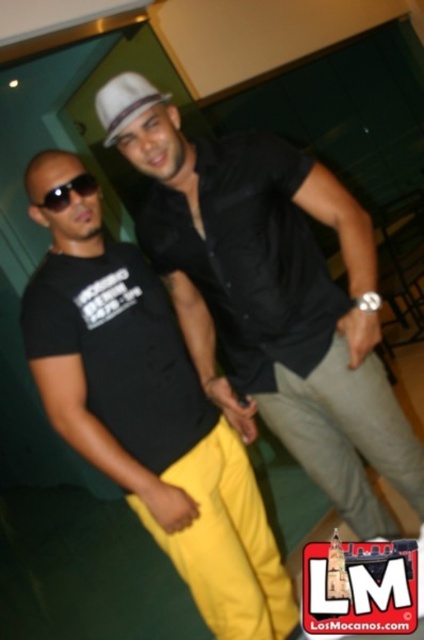
Looking at this image, you are standing in the room and want to place a small plant between the two points, point (256,154) and point (136,106). Which point should the plant be closer to so it is in front of both points?

The plant should be placed closer to point (136,106) because it is in front of point (256,154).